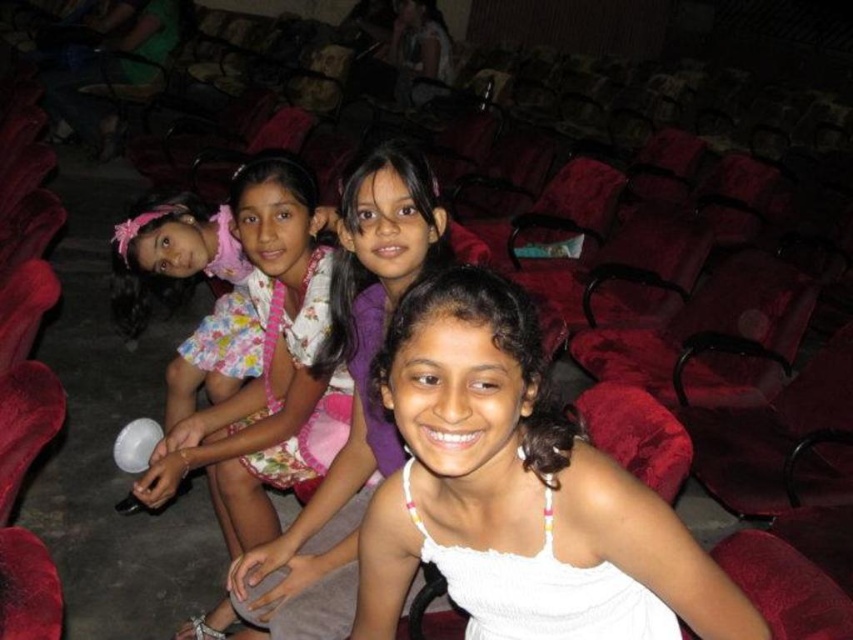
You are a photographer positioned at the origin of the coordinate system. You need to capture a photo of the floral fabric dress at center. What are the coordinates where you should aim your camera?

The coordinates to aim the camera are at point (265,365).

You are a photographer trying to capture a closeup of the floral fabric dress at center and the white cotton dress at center. Given that your camera can focus on objects within a 10 inch range, will you be able to capture both dresses in focus?

The floral fabric dress at center and white cotton dress at center are 11.66 inches apart, which exceeds the camera focus range of 10 inches. Therefore, both dresses cannot be captured in focus simultaneously.

You are a photographer trying to capture a closeup of the white fabric dress at center without including the white cotton dress at center in the frame. Is this possible based on their positions?

The white fabric dress at center is located below the white cotton dress at center, so it might be possible to angle the camera downward to focus on the white fabric dress at center while avoiding the white cotton dress at center above it.